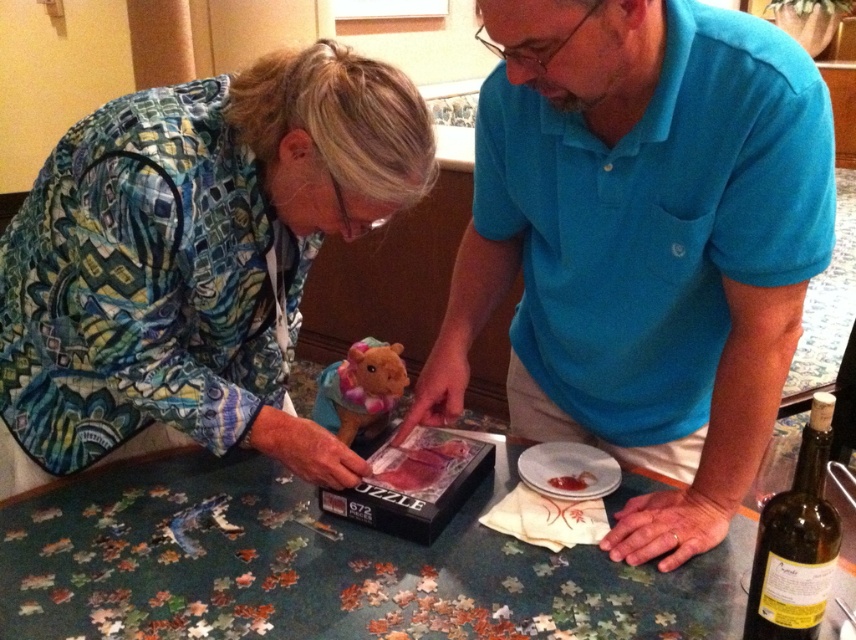
You are standing in front of the puzzle table and want to hand a snack to the person wearing the blue cotton shirt at upper right. Based on their position, where should you aim to place the snack so it reaches them?

The blue cotton shirt at upper right is located at point (642, 243), so you should aim to place the snack near that coordinate to reach them.

You are standing at the origin point of the image. Can you tell me the coordinates of the printed fabric shirt at lower left?

The coordinates of the printed fabric shirt at lower left are at point (x=194, y=260).